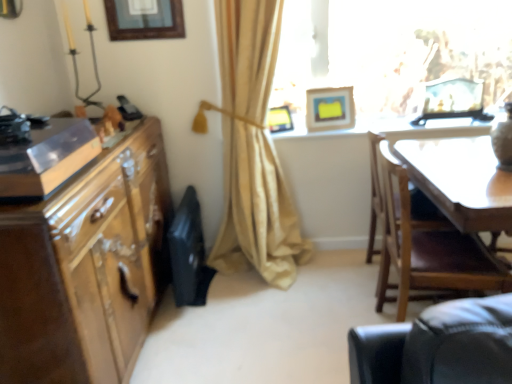
Where is `vacant space in front of beige fabric curtain at center`? The height and width of the screenshot is (384, 512). vacant space in front of beige fabric curtain at center is located at coordinates (249, 324).